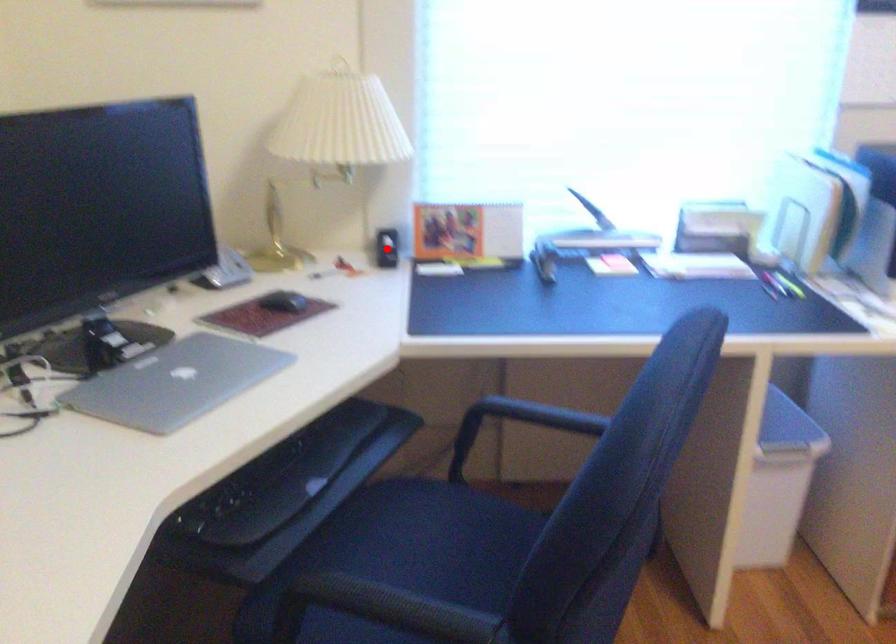
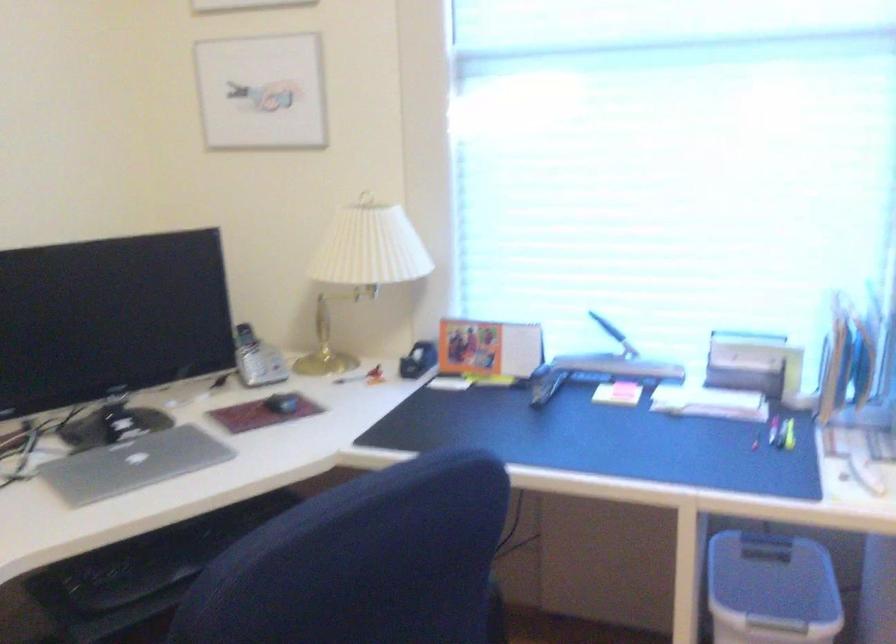
Find the pixel in the second image that matches the highlighted location in the first image.

(418, 360)